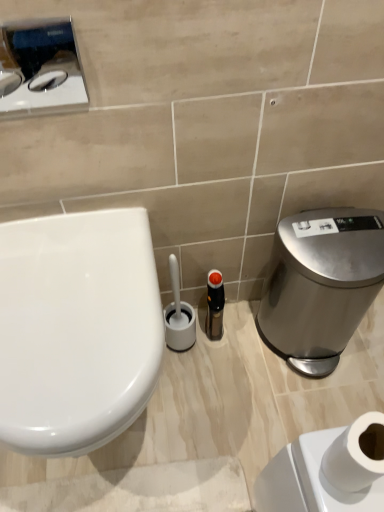
Image resolution: width=384 pixels, height=512 pixels. Identify the location of free point to the left of satin silver trash can at right. (225, 362).